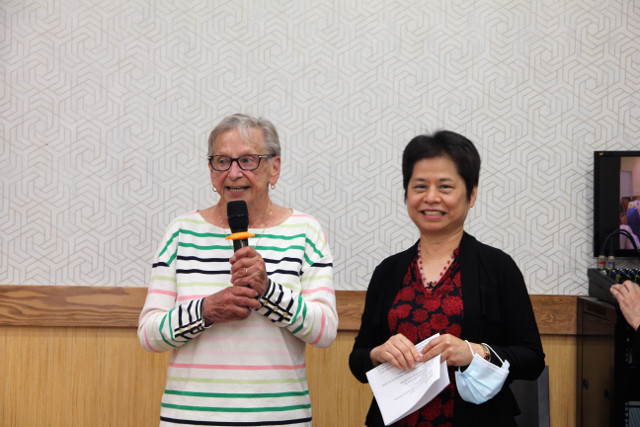
At what (x,y) coordinates should I click in order to perform the action: click on wood trim. Please return your answer as a coordinate pair (x, y). The width and height of the screenshot is (640, 427). Looking at the image, I should click on (70, 306).